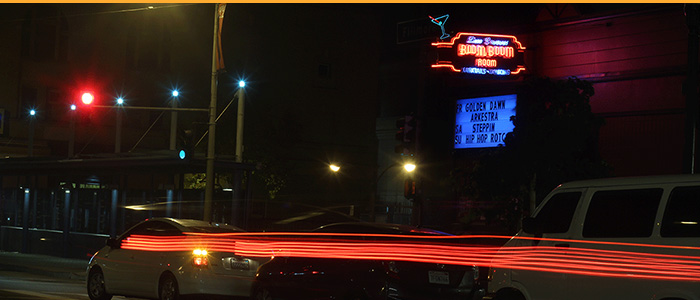
Where is `neon signs`? Image resolution: width=700 pixels, height=300 pixels. neon signs is located at coordinates (470, 58), (477, 113).